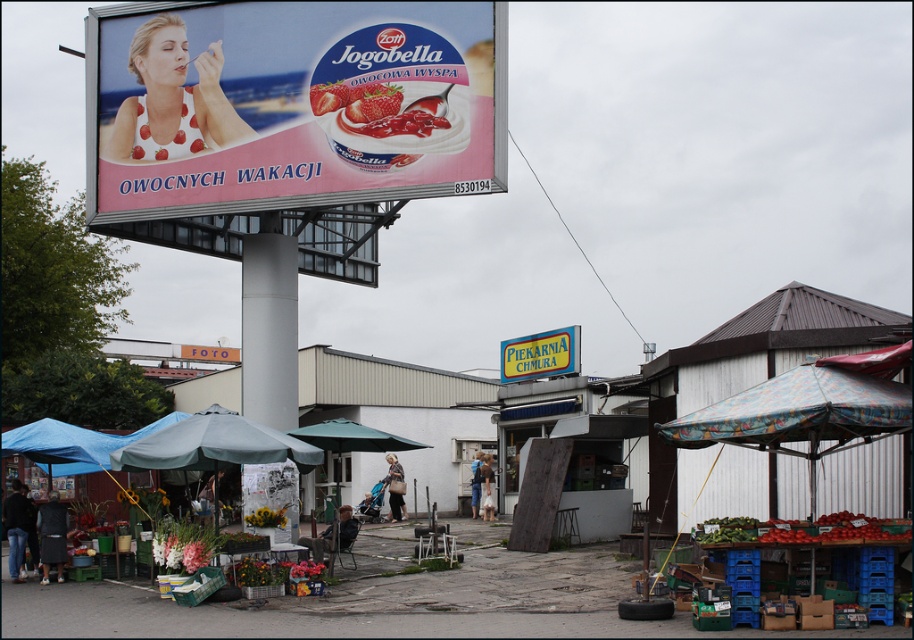
Does matte plastic billboard at upper center have a greater width compared to blue fabric umbrella at center?

Correct, the width of matte plastic billboard at upper center exceeds that of blue fabric umbrella at center.

This screenshot has height=640, width=914. What do you see at coordinates (292, 104) in the screenshot?
I see `matte plastic billboard at upper center` at bounding box center [292, 104].

Which is in front, point (143, 202) or point (283, 452)?

Point (283, 452) is in front.

Identify the location of matte plastic billboard at upper center. The height and width of the screenshot is (640, 914). (292, 104).

Can you confirm if matte plastic billboard at upper center is wider than orange fabric sign at center?

Incorrect, matte plastic billboard at upper center's width does not surpass orange fabric sign at center's.

Where is `matte plastic billboard at upper center`? This screenshot has width=914, height=640. matte plastic billboard at upper center is located at coordinates (292, 104).

Find the location of a particular element. matte plastic billboard at upper center is located at coordinates (292, 104).

Who is more forward, (x=519, y=346) or (x=187, y=348)?

Point (x=519, y=346) is more forward.

Between yellow plastic sign at center and orange fabric sign at center, which one appears on the right side from the viewer's perspective?

Positioned to the right is yellow plastic sign at center.

Where is `yellow plastic sign at center`? yellow plastic sign at center is located at coordinates (540, 355).